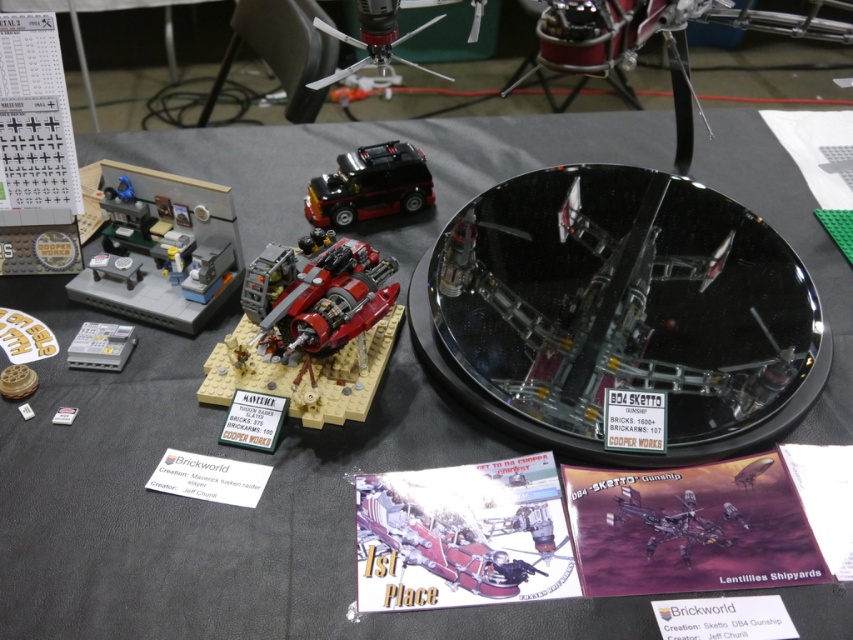
Question: Which point is farther to the camera?

Choices:
 (A) metallic silver gunship at center
 (B) matte gray plastic office desk at upper left
 (C) black glass plate at center

Answer: (B)

Question: Among these points, which one is farthest from the camera?

Choices:
 (A) (364, 276)
 (B) (358, 195)
 (C) (96, 275)
 (D) (697, 531)

Answer: (B)

Question: Is matte black car at center bigger than metallic silver gunship at center?

Choices:
 (A) no
 (B) yes

Answer: (B)

Question: Which point is closer to the camera?

Choices:
 (A) metallic silver gunship at center
 (B) black glass plate at center

Answer: (A)

Question: Does black glass plate at center appear on the right side of matte gray plastic office desk at upper left?

Choices:
 (A) no
 (B) yes

Answer: (B)

Question: Does matte gray plastic office desk at upper left appear on the right side of shiny red plastic spaceship at center?

Choices:
 (A) yes
 (B) no

Answer: (B)